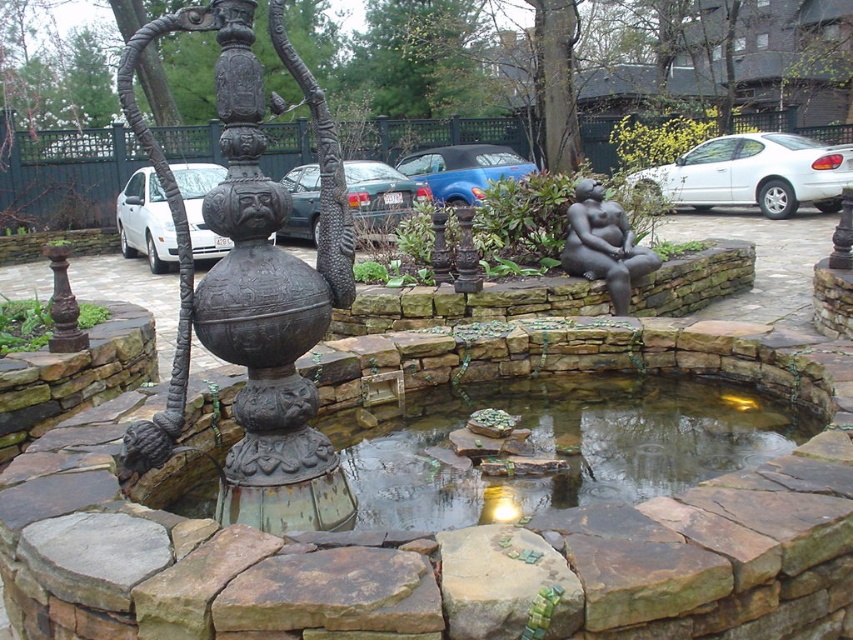
Question: Does green stone pond at center have a greater width compared to white matte car at left?

Choices:
 (A) yes
 (B) no

Answer: (A)

Question: Which of these objects is positioned farthest from the rusty metal fountain at center?

Choices:
 (A) metallic blue sedan at center
 (B) blue metallic car at center
 (C) white glossy sedan at right

Answer: (C)

Question: Is the position of white glossy sedan at right more distant than that of blue metallic car at center?

Choices:
 (A) no
 (B) yes

Answer: (A)

Question: Which point is closer to the camera?

Choices:
 (A) (473, 166)
 (B) (285, 212)
 (C) (141, 237)
 (D) (358, 160)

Answer: (B)

Question: In this image, where is white glossy sedan at right located relative to blue metallic car at center?

Choices:
 (A) below
 (B) above

Answer: (A)

Question: Which object appears farthest from the camera in this image?

Choices:
 (A) green stone pond at center
 (B) white glossy sedan at right

Answer: (B)